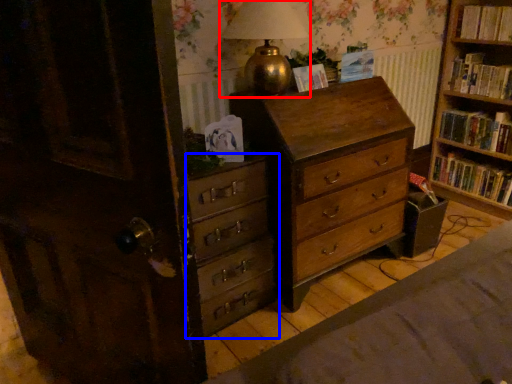
Question: Which object is closer to the camera taking this photo, table lamp (highlighted by a red box) or chest of drawers (highlighted by a blue box)?

Choices:
 (A) table lamp
 (B) chest of drawers

Answer: (A)